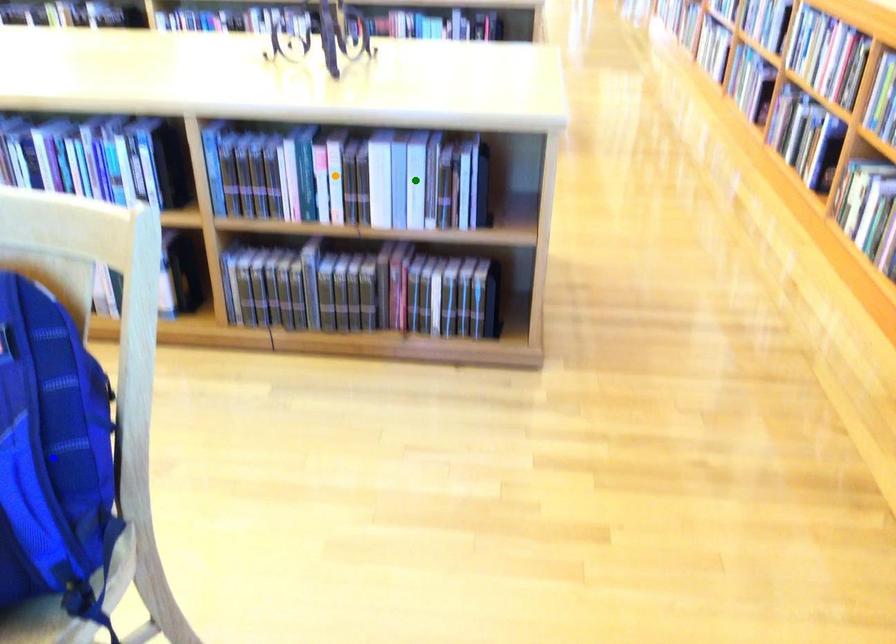
Order these from farthest to nearest:
orange point | blue point | green point

1. orange point
2. green point
3. blue point